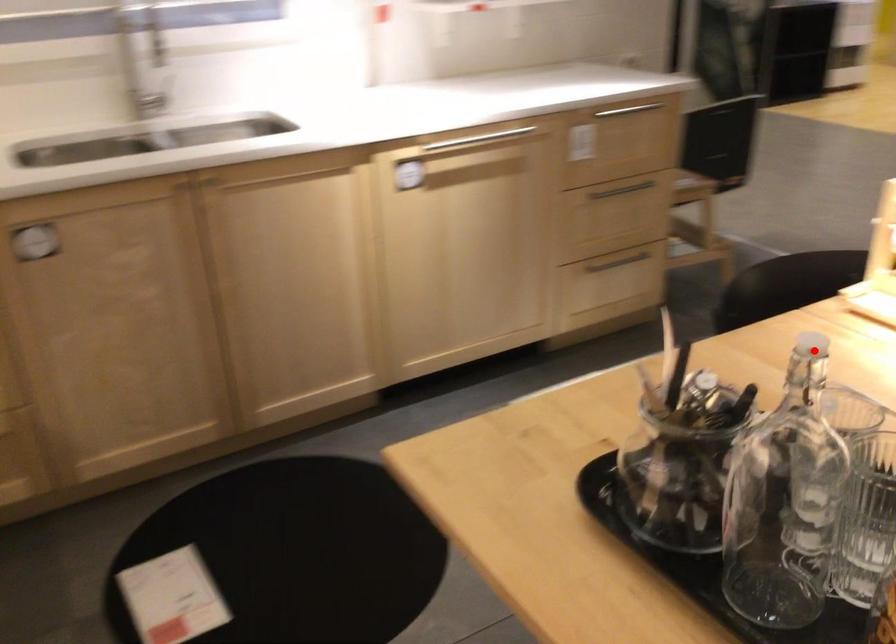
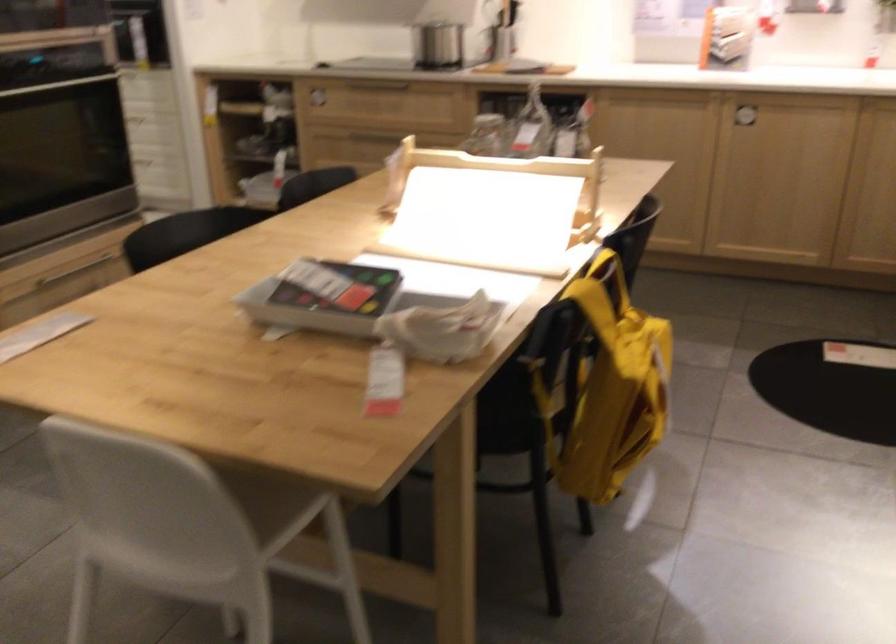
Question: I am providing you with two images of the same scene from different viewpoints. A red point is marked on the first image. Is the red point's position out of view in image 2?

Choices:
 (A) Yes
 (B) No

Answer: (A)